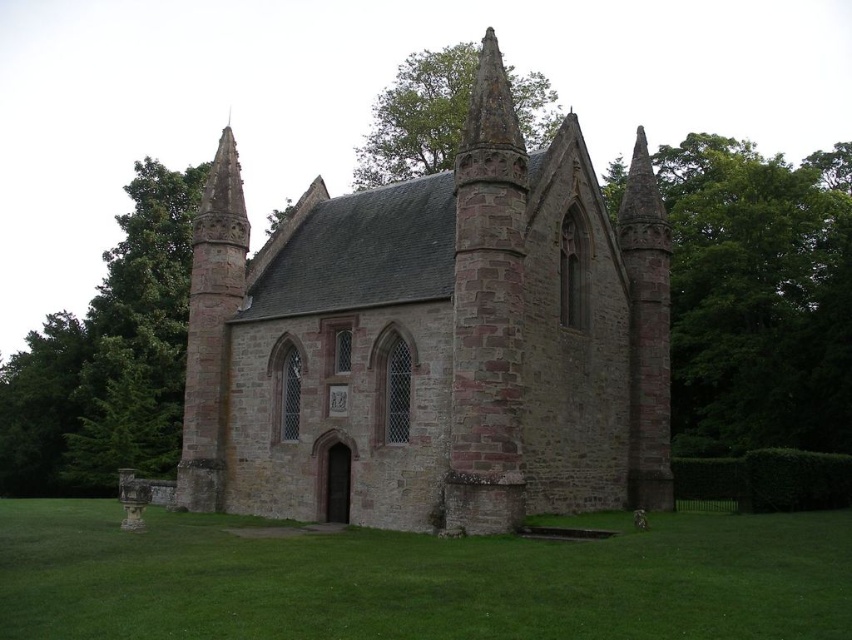
You are standing in front of the historic stone chapel and notice a point marked at coordinates [758,296]. Based on the scene description, what object is located at this point?

The point at coordinates [758,296] indicates a green leafy tree at right.

From the picture: You are standing in front of the historic stone chapel and want to walk towards the green leafy tree at right. Which direction should you move relative to the green grass at lower center?

You should move to the right relative to the green grass at lower center because the green leafy tree at right is located to the right of the green grass at lower center.